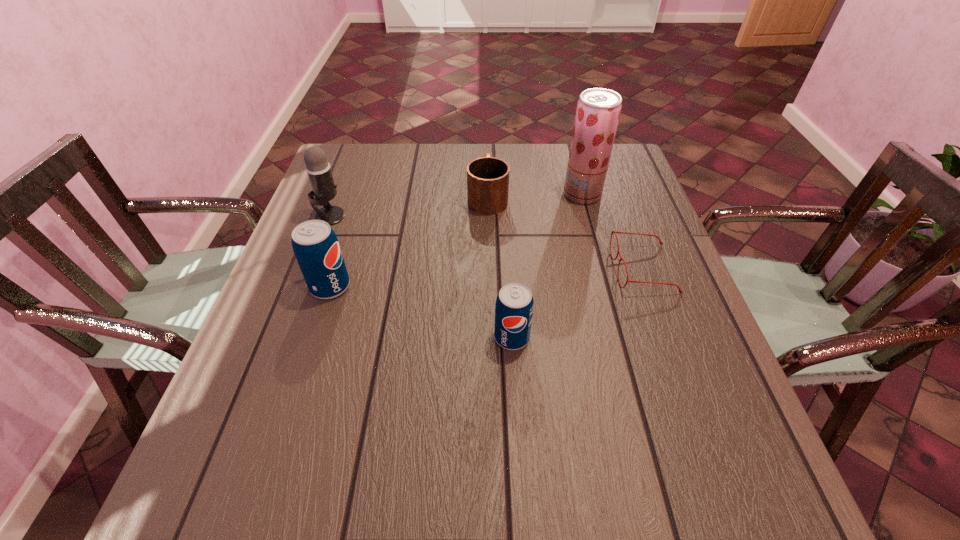
Locate an element on the screen. The image size is (960, 540). vacant point located between the fruit juice and the second shortest object is located at coordinates (535, 195).

At what (x,y) coordinates should I click in order to perform the action: click on blank region between the fruit juice and the mug. Please return your answer as a coordinate pair (x, y). The image size is (960, 540). Looking at the image, I should click on (535, 195).

Point out which object is positioned as the second nearest to the shortest object. Please provide its 2D coordinates. Your answer should be formatted as a tuple, i.e. [(x, y)], where the tuple contains the x and y coordinates of a point satisfying the conditions above.

[(514, 306)]

Identify which object is the fourth closest to the tallest object. Please provide its 2D coordinates. Your answer should be formatted as a tuple, i.e. [(x, y)], where the tuple contains the x and y coordinates of a point satisfying the conditions above.

[(316, 247)]

Locate an element on the screen. vacant space that satisfies the following two spatial constraints: 1. on the back side of the taller pop; 2. on the left side of the fruit juice is located at coordinates (360, 194).

The height and width of the screenshot is (540, 960). In order to click on free spot that satisfies the following two spatial constraints: 1. on the face of the shortest object; 2. on the front side of the farther pop in this screenshot , I will do `click(650, 287)`.

The height and width of the screenshot is (540, 960). What are the coordinates of `free region that satisfies the following two spatial constraints: 1. on the face of the spectacles; 2. on the front side of the shorter pop` in the screenshot? It's located at (668, 338).